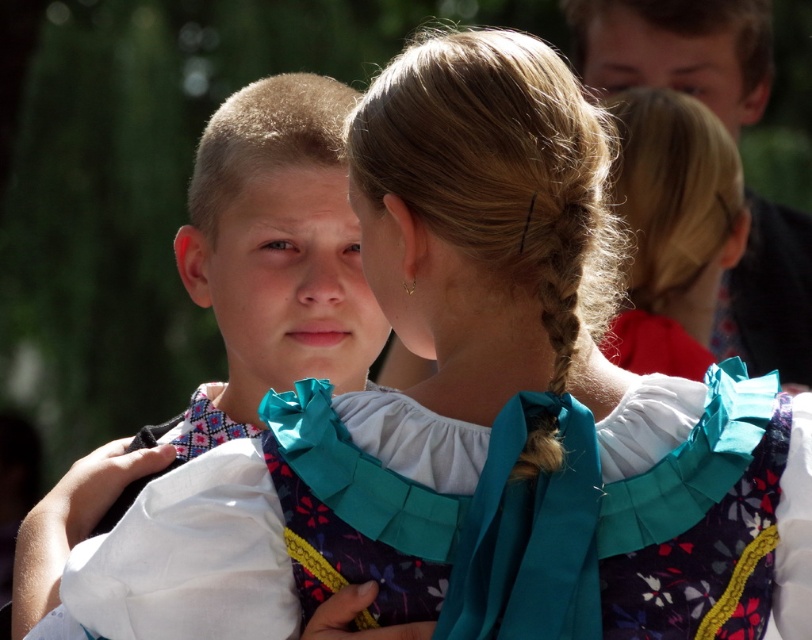
In the scene of two children in traditional outfits, there is a floral fabric dress at center and a teal satin ribbon at center. Which object is positioned to the left?

The floral fabric dress at center is to the left of the teal satin ribbon at center.

You are a photographer trying to capture a candid shot of both children in the scene. You notice two points marked in the image. The first point is at coordinate point (x=230, y=132) and the second is at point (x=769, y=10). Which point should you focus on to ensure the child in front is in clear focus?

Point (x=230, y=132) is in front of point (x=769, y=10), so focusing on point (x=230, y=132) will ensure the child in front is in clear focus.

You are standing in front of the scene and want to locate the floral fabric dress at center. Can you describe its position relative to the other objects in the scene?

The floral fabric dress at center is located at the point with coordinates 0.861 on the horizontal axis and 0.229 on the vertical axis.